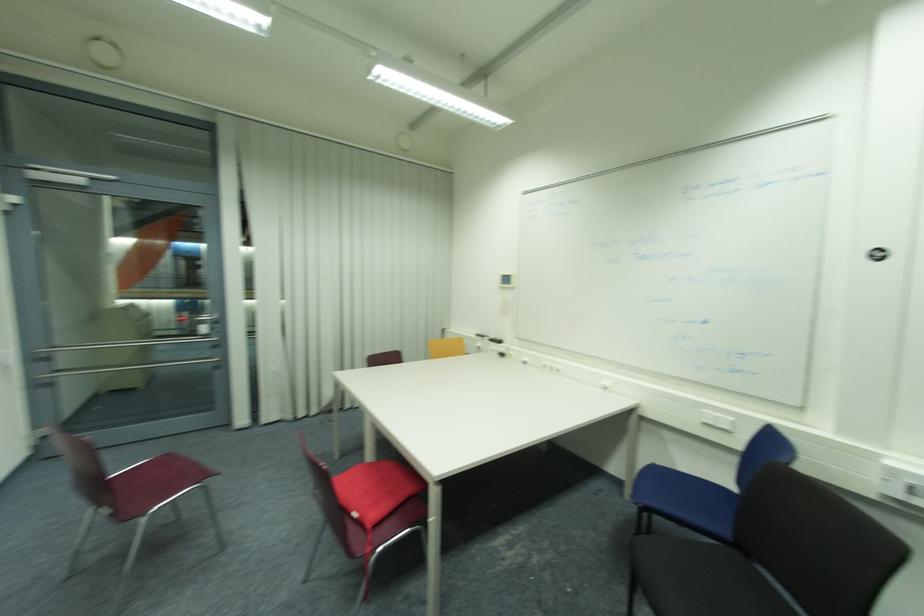
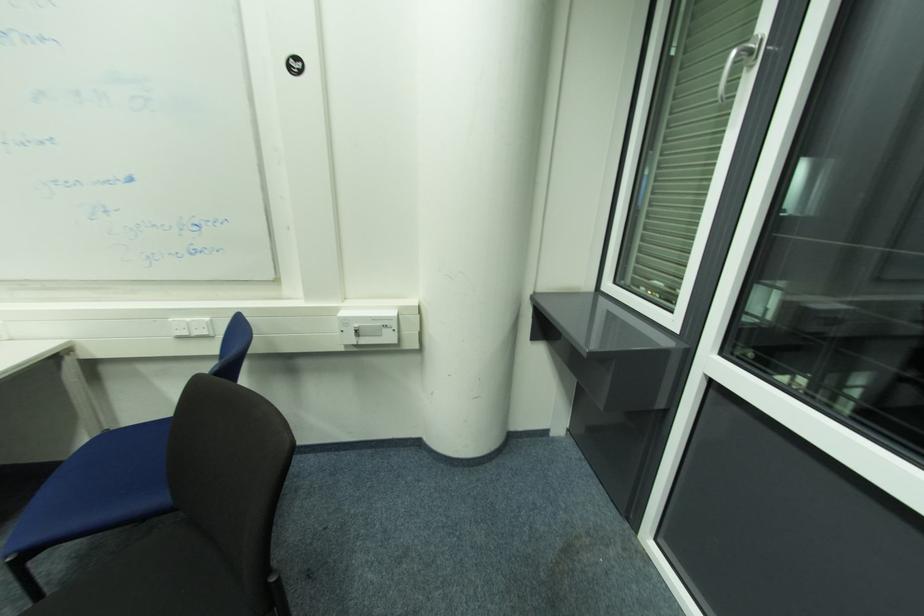
Based on the continuous images, in which direction is the camera rotating?

The rotation direction of the camera is right-down.